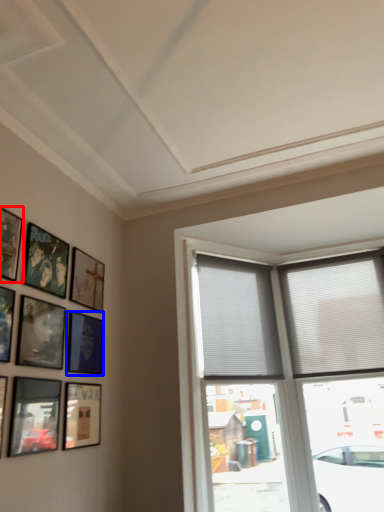
Question: Among these objects, which one is nearest to the camera, picture frame (highlighted by a red box) or picture frame (highlighted by a blue box)?

Choices:
 (A) picture frame
 (B) picture frame

Answer: (A)